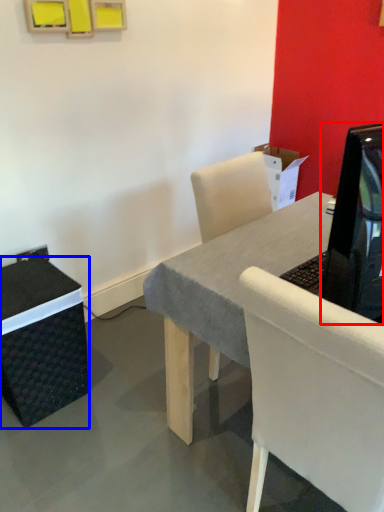
Question: Which of the following is the farthest to the observer, television (highlighted by a red box) or box (highlighted by a blue box)?

Choices:
 (A) television
 (B) box

Answer: (B)